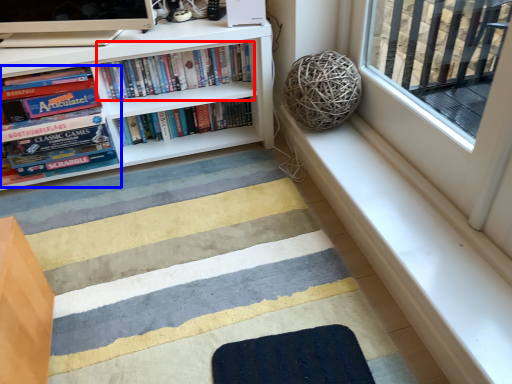
Question: Which point is further to the camera, book (highlighted by a red box) or book (highlighted by a blue box)?

Choices:
 (A) book
 (B) book

Answer: (A)